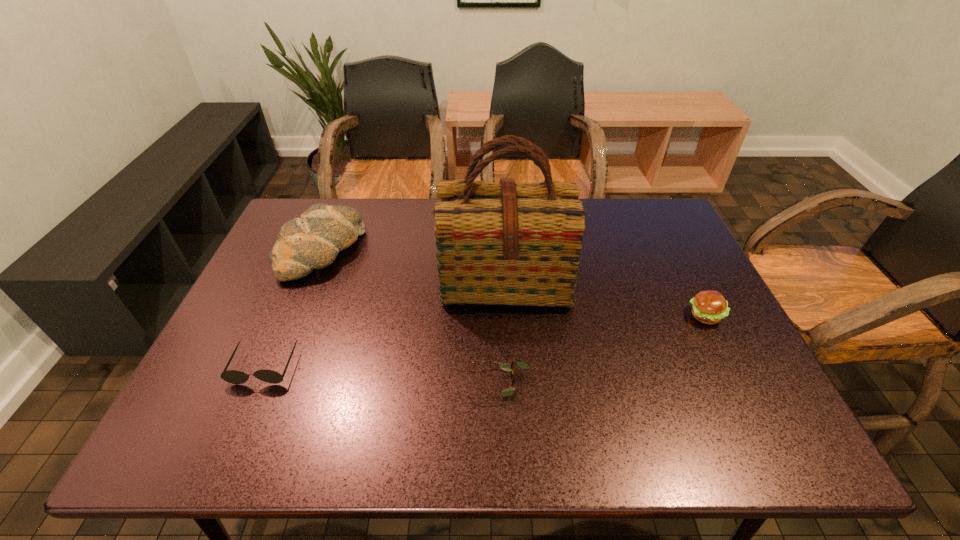
Where is `vacant space at the right edge of the desktop`? This screenshot has width=960, height=540. vacant space at the right edge of the desktop is located at coordinates (691, 275).

The width and height of the screenshot is (960, 540). Identify the location of vacant area at the far left corner of the desktop. (339, 203).

In the image, there is a desktop. Identify the location of vacant space at the near right corner. The height and width of the screenshot is (540, 960). (774, 427).

Locate an element on the screen. This screenshot has width=960, height=540. vacant area between the shopping bag and the hamburger is located at coordinates (605, 298).

Find the location of `vacant area that lies between the third shortest object and the spectacles`. vacant area that lies between the third shortest object and the spectacles is located at coordinates (602, 349).

Where is `vacant space that's between the fourth shortest object and the spectacles`? This screenshot has width=960, height=540. vacant space that's between the fourth shortest object and the spectacles is located at coordinates (411, 317).

Locate an element on the screen. Image resolution: width=960 pixels, height=540 pixels. free spot between the fourth tallest object and the fourth shortest object is located at coordinates (293, 308).

The height and width of the screenshot is (540, 960). I want to click on free space between the fourth tallest object and the second tallest object, so click(293, 308).

The image size is (960, 540). What are the coordinates of `vacant area that lies between the shortest object and the sunglasses` in the screenshot? It's located at click(x=382, y=375).

Identify the location of vacant region between the shortest object and the tallest object. (502, 332).